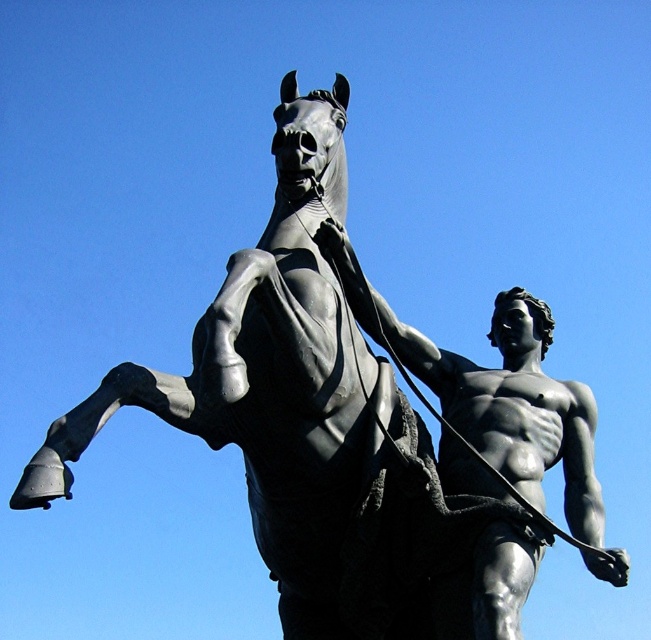
You are an art conservator examining the statue from a distance. The polished bronze horse at center is positioned at coordinates point 0.600, 0.410. If you need to place a protective barrier around the statue, which part of the statue should you position it closer to based on the horse location?

The polished bronze horse at center is located at point (266, 384), so the protective barrier should be positioned closer to the center of the statue where the horse is situated.

You are an art curator planning to display both the polished bronze horse at center and the polished bronze statue at center in a gallery. Based on their sizes, which one should be placed on a higher pedestal to ensure proper visibility?

The polished bronze horse at center has a greater height compared to the polished bronze statue at center, so it should be placed on a higher pedestal to ensure proper visibility.

You are an art curator planning to display both the polished bronze horse at center and the polished bronze statue at center in a gallery. Considering their sizes, which object should be placed on a taller pedestal to ensure proper visibility?

The polished bronze horse at center is smaller than the polished bronze statue at center, so it should be placed on a taller pedestal to ensure proper visibility.